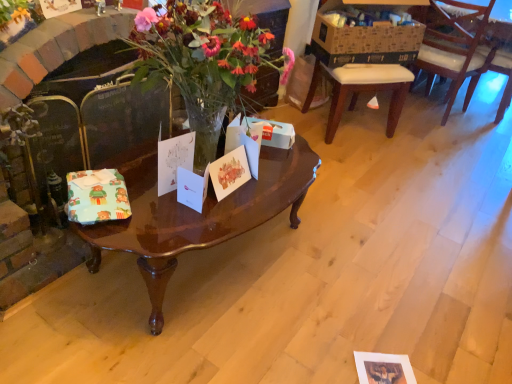
The width and height of the screenshot is (512, 384). Identify the location of vacant region to the left of white paper gift card at center, arranged as the third gift card when viewed from the left. (146, 196).